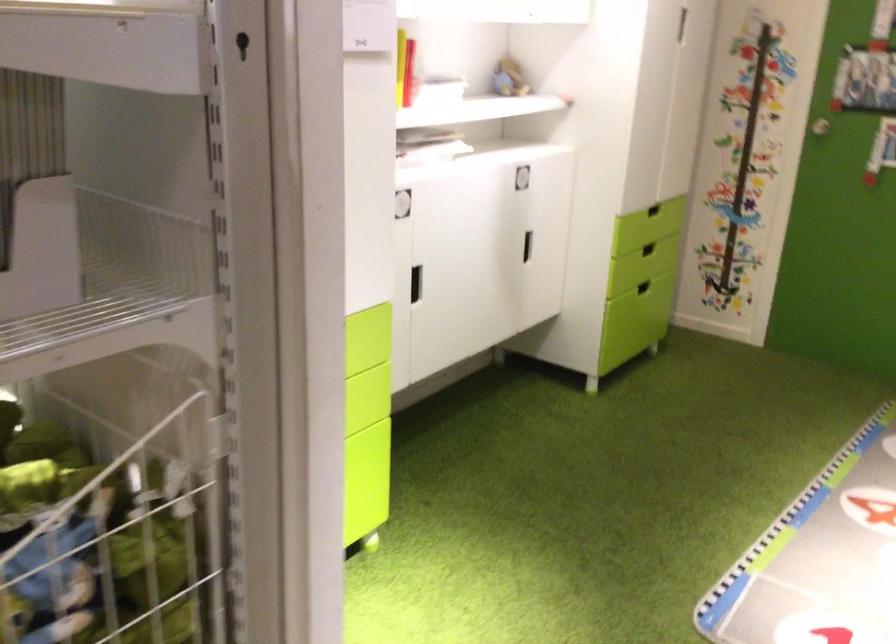
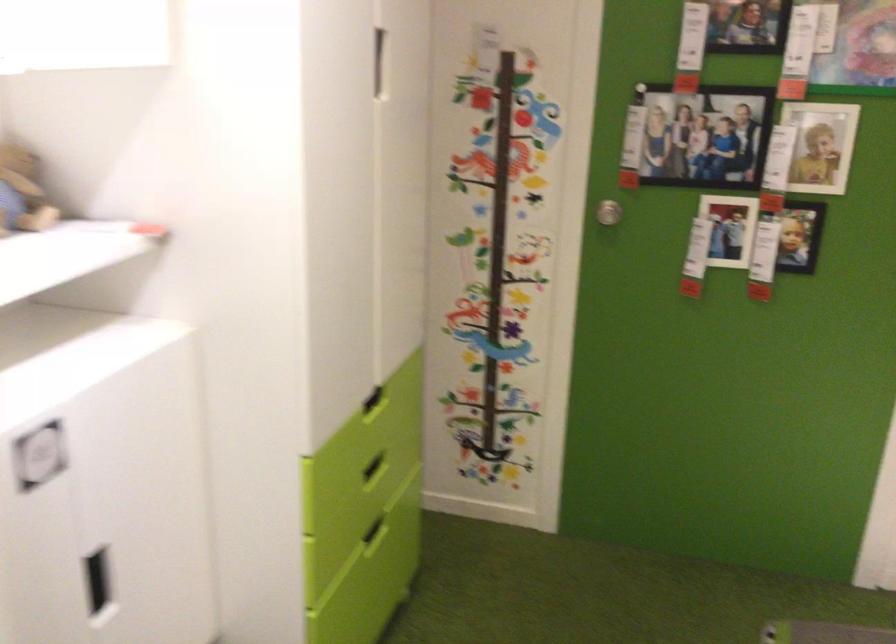
Question: Which direction would the cameraman need to move to produce the second image? Reply with the corresponding letter.

Choices:
 (A) Left
 (B) Right
 (C) Forward
 (D) Backward

Answer: (C)